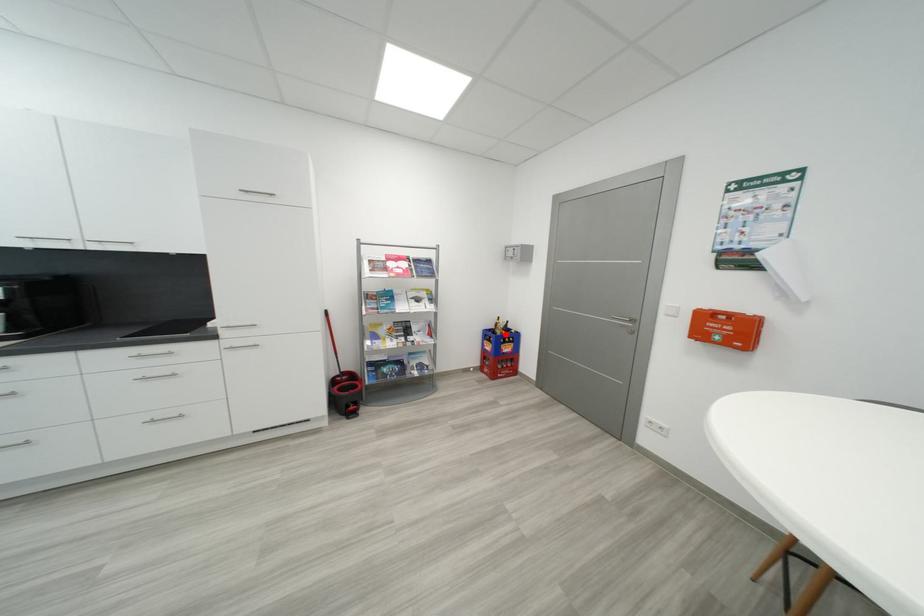
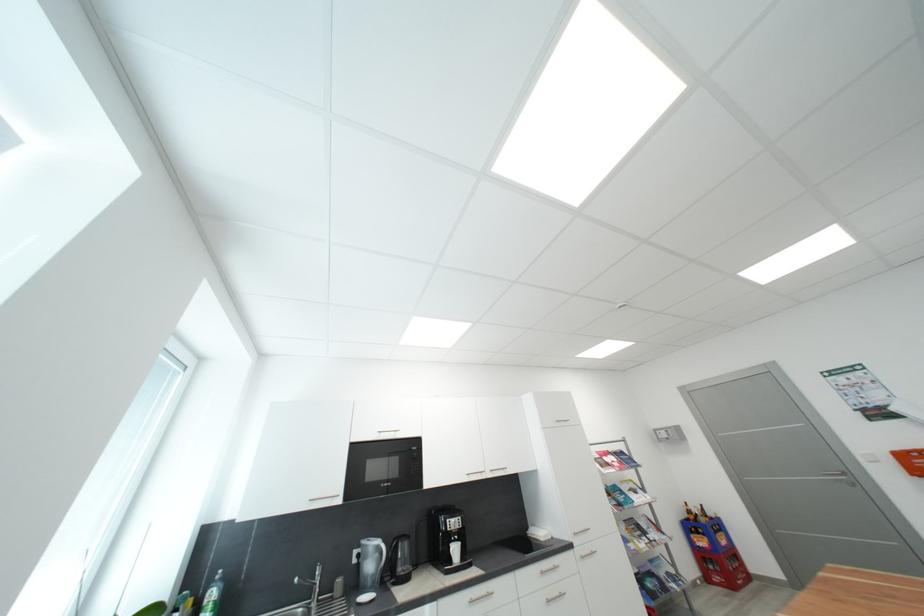
The point at the highlighted location is marked in the first image. Where is the corresponding point in the second image?

(710, 522)